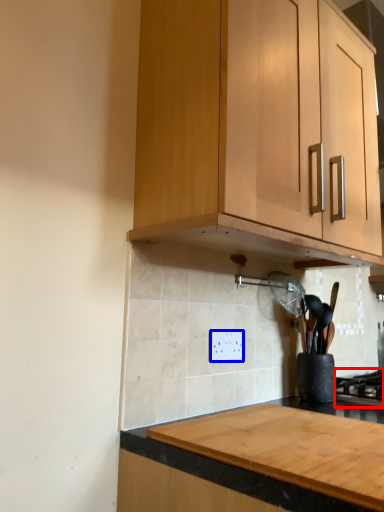
Question: Which object is closer to the camera taking this photo, gas stove (highlighted by a red box) or electric outlet (highlighted by a blue box)?

Choices:
 (A) gas stove
 (B) electric outlet

Answer: (B)